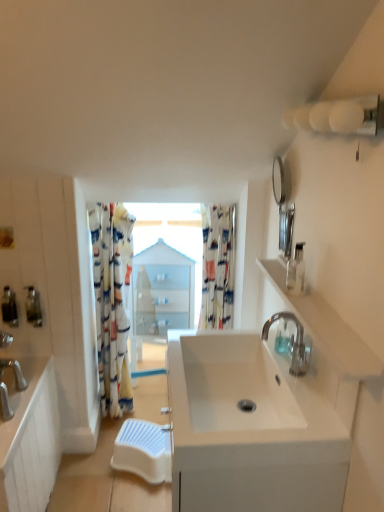
Locate an element on the screen. This screenshot has height=512, width=384. free spot below white glossy sink at right (from a real-world perspective) is located at coordinates (318, 391).